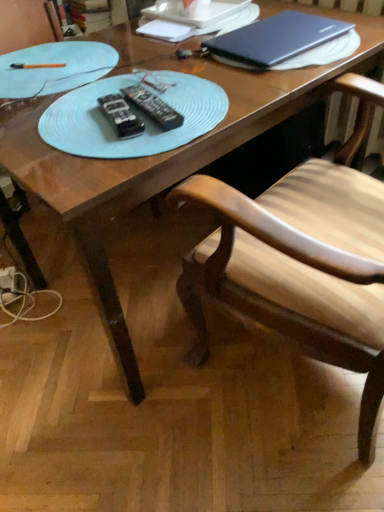
Where is `free spot to the right of light blue plastic plate at upper left`? Image resolution: width=384 pixels, height=512 pixels. free spot to the right of light blue plastic plate at upper left is located at coordinates (175, 73).